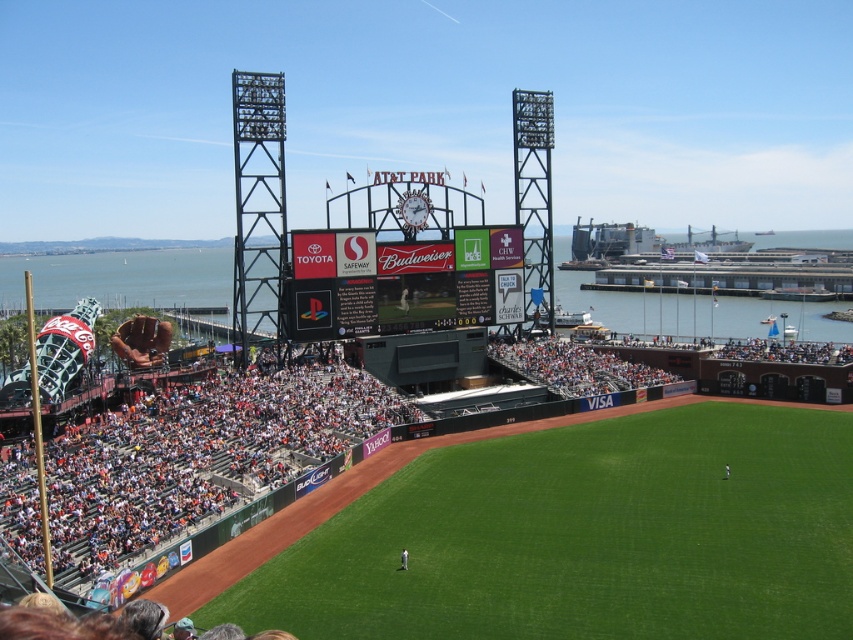
Question: From the image, what is the correct spatial relationship of green grass at center in relation to black matte scoreboard at center?

Choices:
 (A) left
 (B) right

Answer: (B)

Question: Is green grass at center closer to camera compared to black matte scoreboard at center?

Choices:
 (A) yes
 (B) no

Answer: (A)

Question: Which point is closer to the camera?

Choices:
 (A) (490, 280)
 (B) (697, 460)

Answer: (B)

Question: Can you confirm if green grass at center is positioned to the left of black matte scoreboard at center?

Choices:
 (A) yes
 (B) no

Answer: (B)

Question: Which point is closer to the camera?

Choices:
 (A) black matte scoreboard at center
 (B) green grass at center

Answer: (B)

Question: Which point appears farthest from the camera in this image?

Choices:
 (A) (316, 262)
 (B) (795, 566)

Answer: (A)